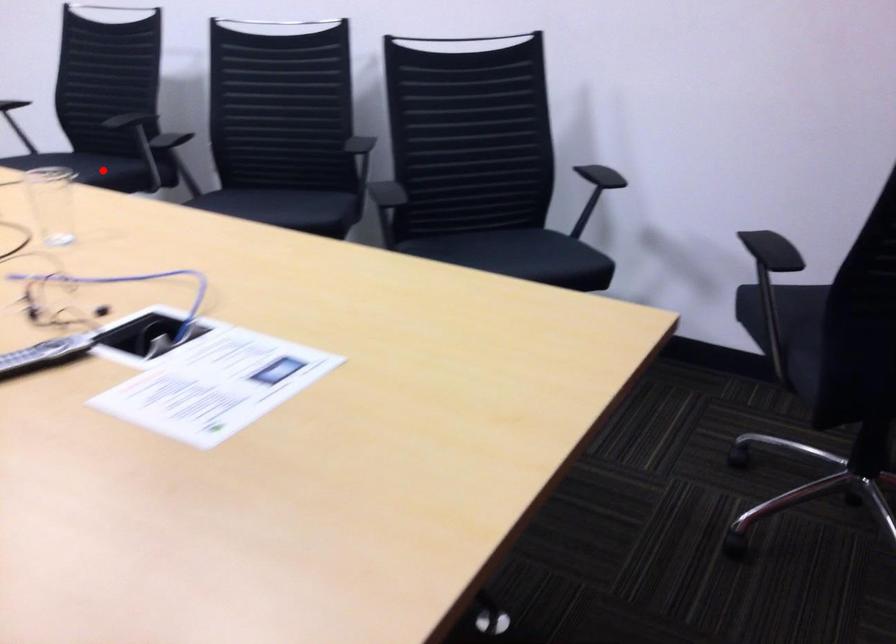
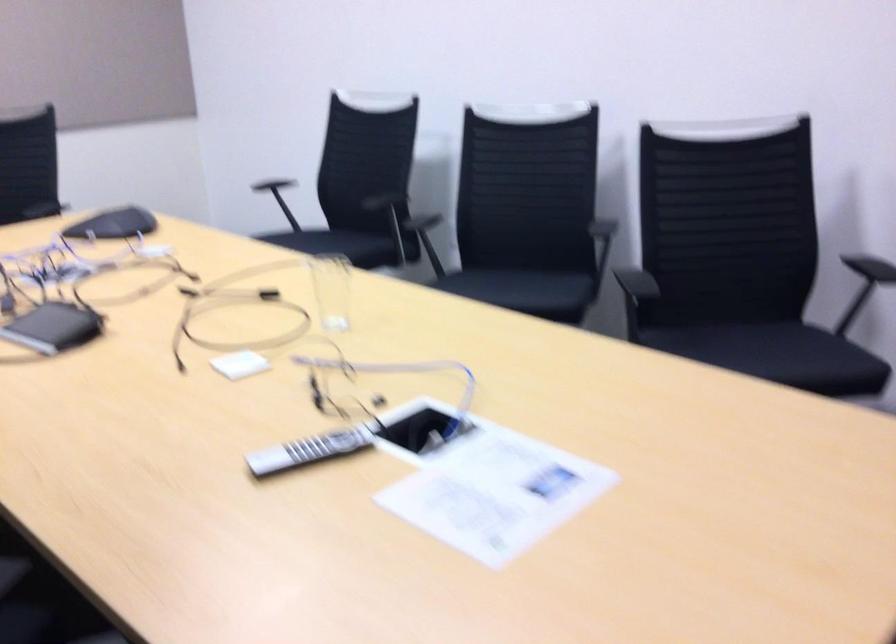
Question: I am providing you with two images of the same scene from different viewpoints. Image1 has a red point marked. In image2, the corresponding 3D location appears at what relative position? Reply with the corresponding letter.

Choices:
 (A) Closer
 (B) Farther

Answer: (B)